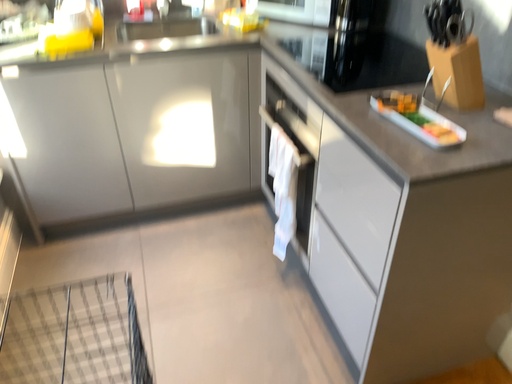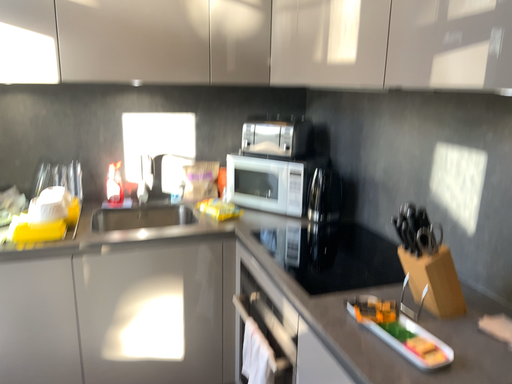
Question: Which way did the camera rotate in the video?

Choices:
 (A) rotated upward
 (B) rotated downward

Answer: (A)